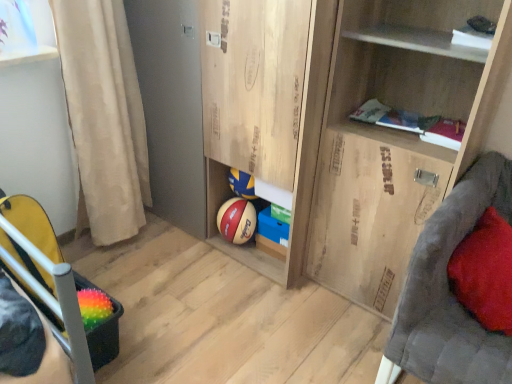
This screenshot has width=512, height=384. Find the location of `empty space that is to the right of beige fabric curtain at left`. empty space that is to the right of beige fabric curtain at left is located at coordinates (173, 246).